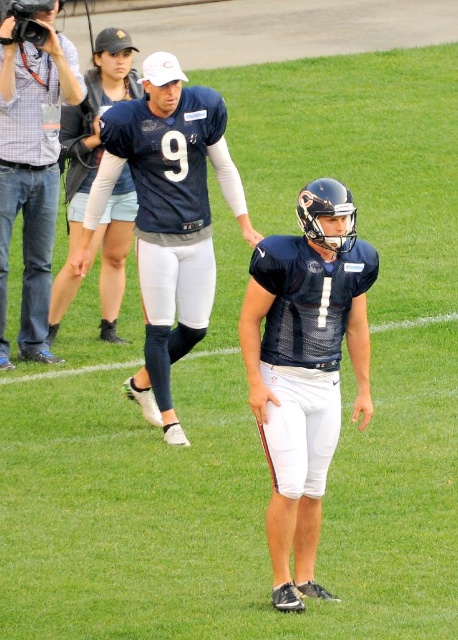
Question: Estimate the real-world distances between objects in this image. Which object is farther from the matte black camera at left?

Choices:
 (A) navy blue uniform at center
 (B) white matte sideline at lower center
 (C) matte blue uniform at center

Answer: (A)

Question: Is matte blue uniform at center positioned in front of matte black camera at left?

Choices:
 (A) yes
 (B) no

Answer: (A)

Question: Is navy blue uniform at center above matte black camera at left?

Choices:
 (A) yes
 (B) no

Answer: (B)

Question: Is matte blue uniform at center closer to camera compared to matte black camera at left?

Choices:
 (A) no
 (B) yes

Answer: (B)

Question: Which point is closer to the camera taking this photo?

Choices:
 (A) (441, 316)
 (B) (360, 381)

Answer: (B)

Question: Which point is farther to the camera?

Choices:
 (A) white matte sideline at lower center
 (B) navy blue uniform at center
 (C) matte black camera at left

Answer: (A)